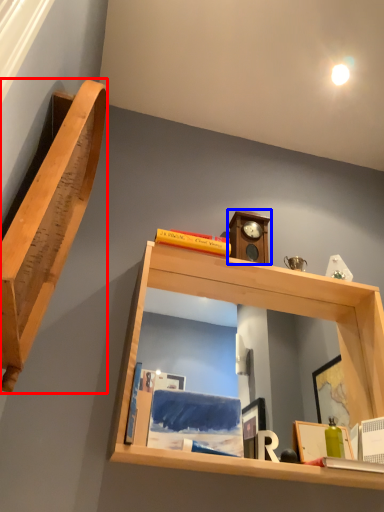
Question: Among these objects, which one is farthest to the camera, shelf (highlighted by a red box) or clock (highlighted by a blue box)?

Choices:
 (A) shelf
 (B) clock

Answer: (B)